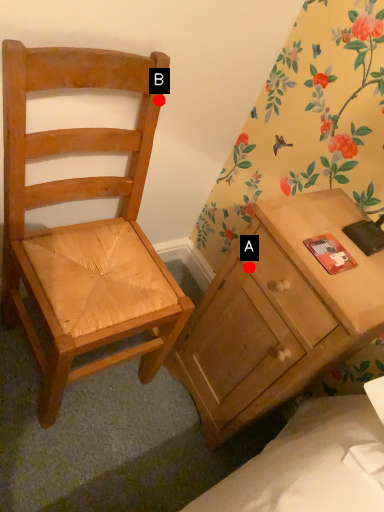
Question: Two points are circled on the image, labeled by A and B beside each circle. Which point is closer to the camera taking this photo?

Choices:
 (A) A is closer
 (B) B is closer

Answer: (A)